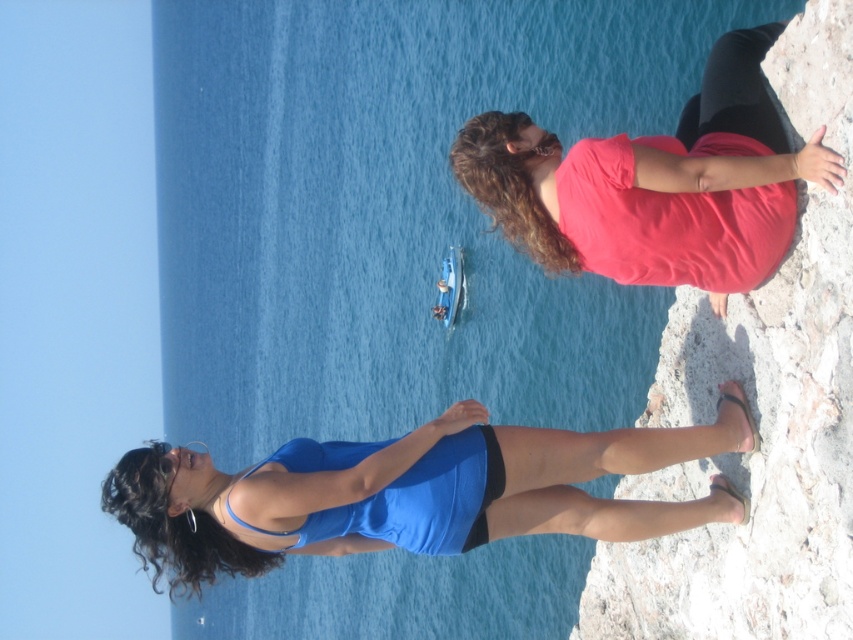
From the picture: You are a photographer trying to capture the scene of two people on a rocky outcrop. You notice the matte blue dress at lower center and the blue matte bikini top at lower center. Which clothing item is closer to the camera?

The matte blue dress at lower center is in front of the blue matte bikini top at lower center, so the matte blue dress at lower center is closer to the camera.